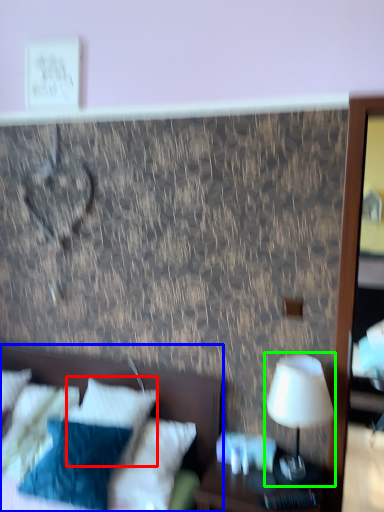
Question: Considering the real-world distances, which object is closest to pillow (highlighted by a red box)? bed (highlighted by a blue box) or table lamp (highlighted by a green box).

Choices:
 (A) bed
 (B) table lamp

Answer: (A)